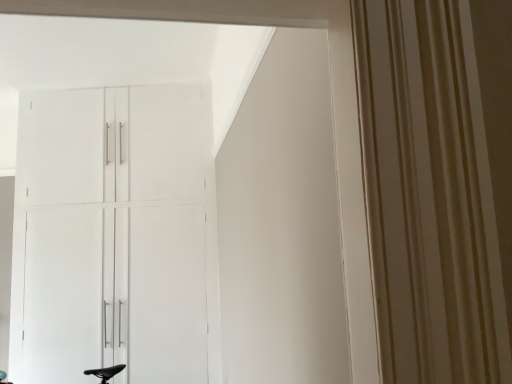
The height and width of the screenshot is (384, 512). What are the coordinates of `white matte cabinet at upper left` in the screenshot? It's located at (112, 233).

The width and height of the screenshot is (512, 384). What do you see at coordinates (112, 233) in the screenshot? I see `white matte cabinet at upper left` at bounding box center [112, 233].

Find the location of a particular element. Image resolution: width=512 pixels, height=384 pixels. white matte cabinet at upper left is located at coordinates (112, 233).